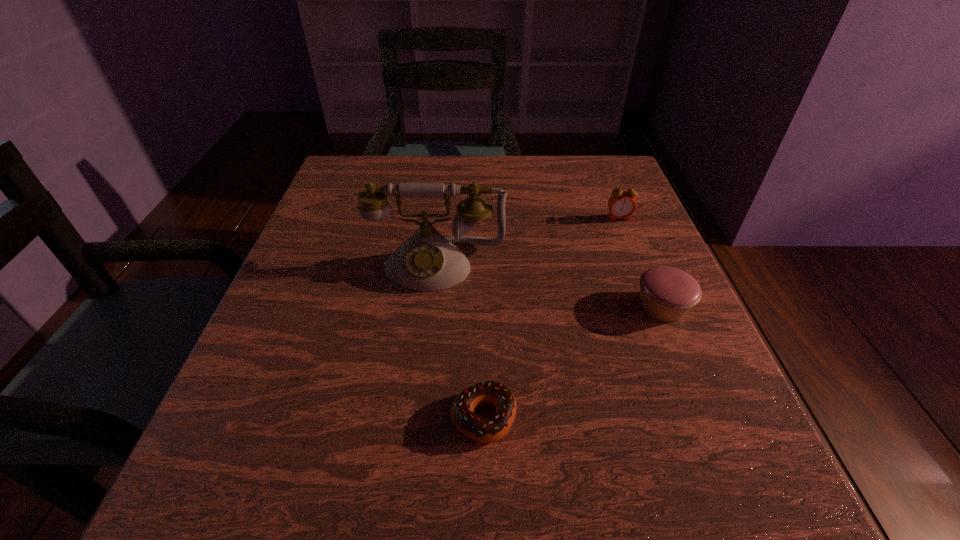
Locate an element on the screen. The width and height of the screenshot is (960, 540). empty space that is in between the nearest object and the farthest object is located at coordinates (551, 318).

Where is `blank region between the alarm clock and the third tallest object`? Image resolution: width=960 pixels, height=540 pixels. blank region between the alarm clock and the third tallest object is located at coordinates (640, 262).

At what (x,y) coordinates should I click in order to perform the action: click on vacant space that's between the second shortest object and the tallest object. Please return your answer as a coordinate pair (x, y). This screenshot has width=960, height=540. Looking at the image, I should click on (549, 286).

The height and width of the screenshot is (540, 960). Find the location of `free area in between the second shortest object and the shortest object`. free area in between the second shortest object and the shortest object is located at coordinates (573, 362).

Locate an element on the screen. free area in between the nearest object and the cupcake is located at coordinates (573, 362).

In order to click on free space between the telephone and the alarm clock in this screenshot , I will do `click(528, 241)`.

Locate an element on the screen. Image resolution: width=960 pixels, height=540 pixels. free space between the cupcake and the farthest object is located at coordinates [640, 262].

Identify the location of vacant area that lies between the nearest object and the telephone. (460, 341).

Find the location of a particular element. The image size is (960, 540). vacant area that lies between the third shortest object and the doughnut is located at coordinates (551, 318).

Identify the location of the second closest object to the alarm clock. The height and width of the screenshot is (540, 960). (427, 261).